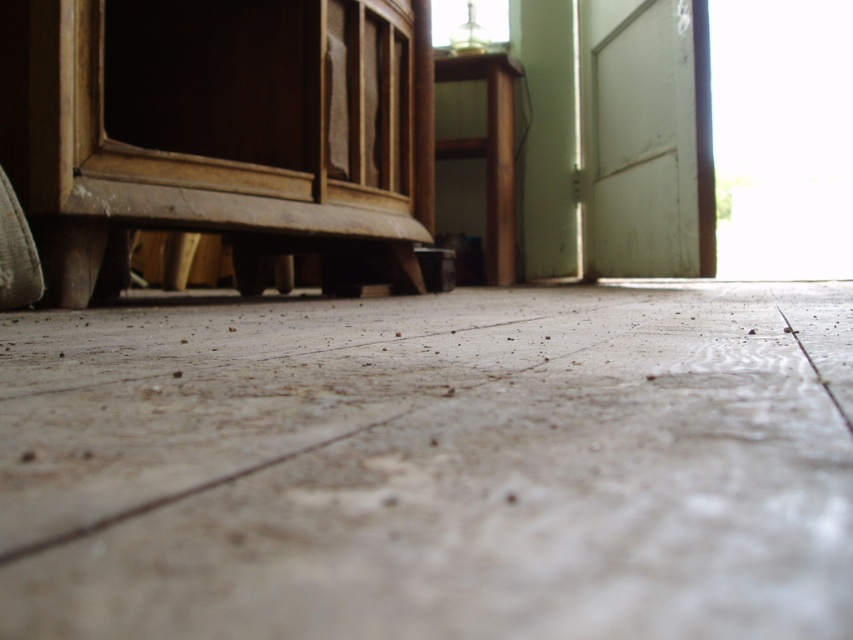
You are standing in the room and want to move from the wooden dresser at left to the wooden stool at center. Which direction should you move to reach the stool?

To reach the wooden stool at center from the wooden dresser at left, you should move to the right since the wooden dresser at left is to the left of the wooden stool at center.

You are standing in the room and want to place a new rug in the center of the floor. Considering the wooden dresser at left, which is positioned at coordinates approximately 0.208 on the x and 0.260 on the y axis, will the rug overlap with the dresser if you place it exactly at the center of the room?

The wooden dresser at left is located at point (221, 132). Since the center of the room would be at coordinates around (426, 320), placing the rug there would not overlap with the dresser as it is positioned further to the left and lower down compared to the center point.